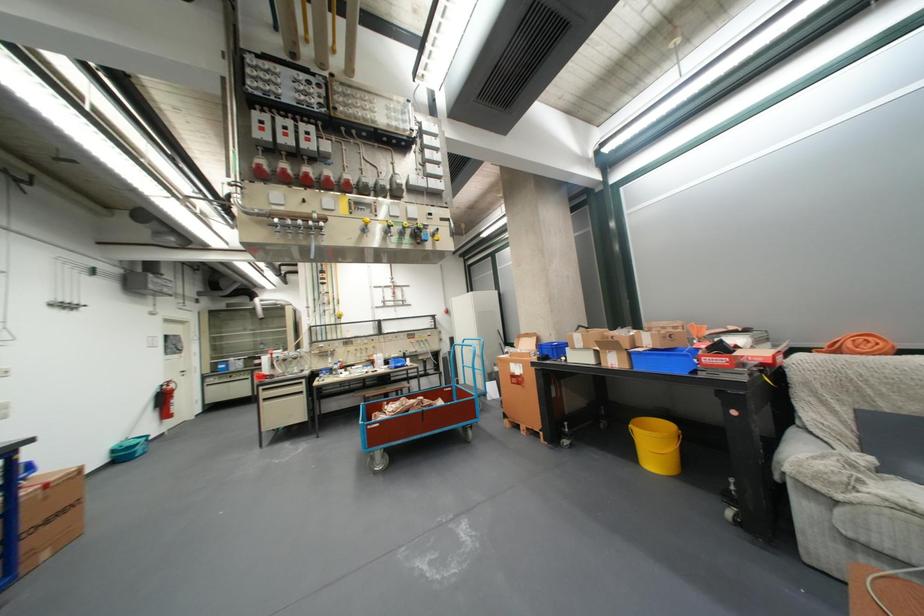
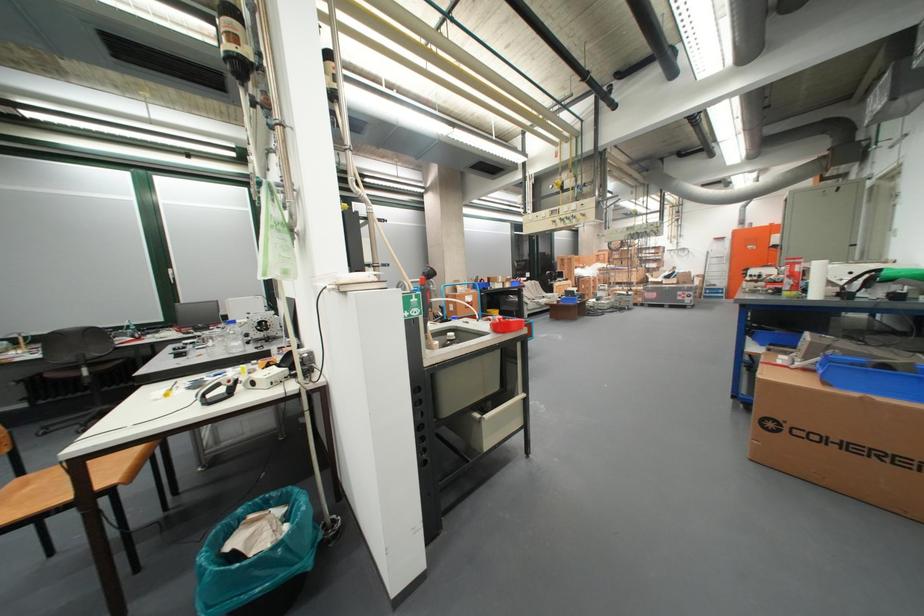
Question: I am providing you with two images of the same scene from different viewpoints. After the viewpoint changes to image2, which objects are now occluded?

Choices:
 (A) blue cart handle
 (B) red plastic bowl
 (C) black chair sitting surface
 (D) yellow control knob

Answer: (A)